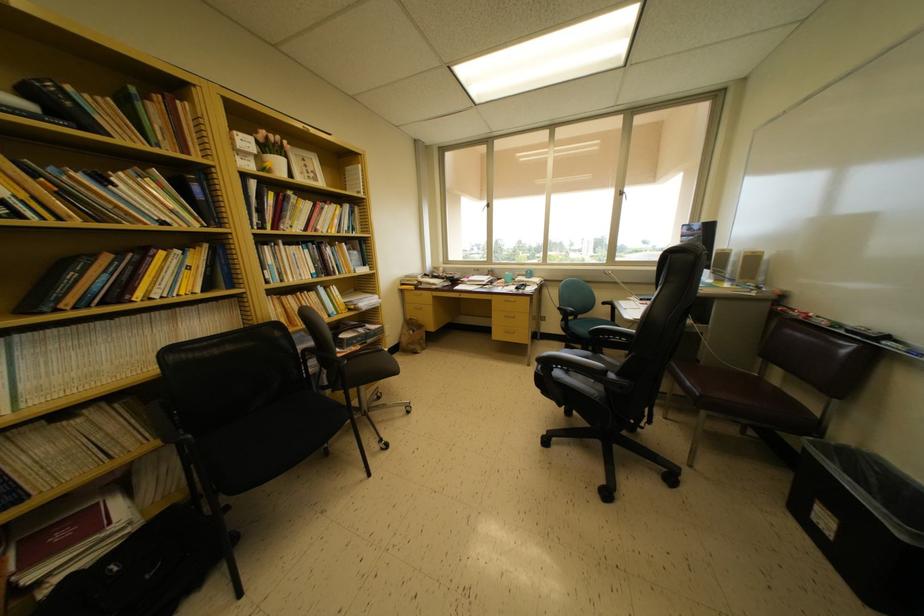
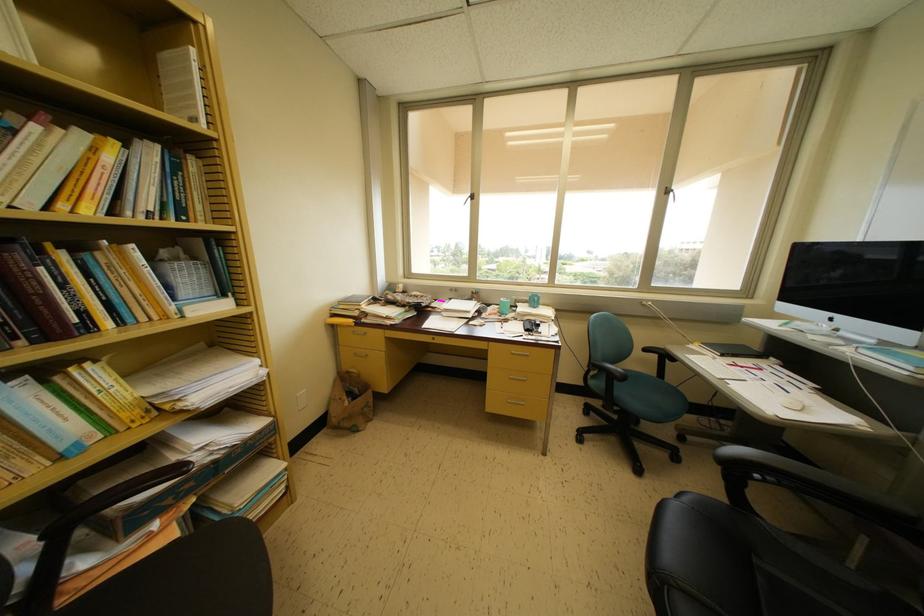
In the second image, find the point that corresponds to (x=407, y=349) in the first image.

(337, 424)